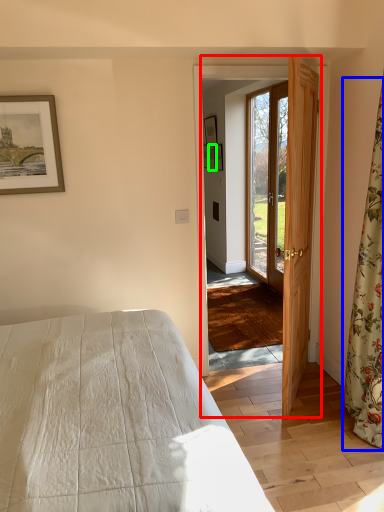
Question: Considering the real-world distances, which object is closest to screen door (highlighted by a red box)? curtain (highlighted by a blue box) or picture frame (highlighted by a green box).

Choices:
 (A) curtain
 (B) picture frame

Answer: (A)